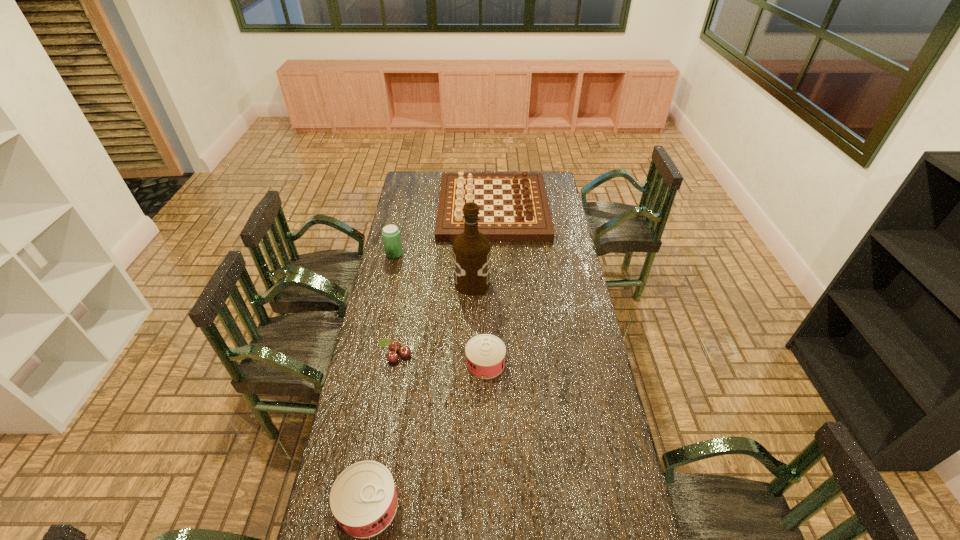
Locate an element on the screen. free space located on the back of the shortest object is located at coordinates (485, 292).

Identify the location of vacant space positioned on the side with the white pieces of the gameboard. Image resolution: width=960 pixels, height=540 pixels. (407, 208).

You are a GUI agent. You are given a task and a screenshot of the screen. Output one action in this format:
    pyautogui.click(x=<x>, y=<y>)
    Task: Click on the vacant space situated 0.180m on the side with the white pieces of the gameboard
    
    Given the screenshot: What is the action you would take?
    pyautogui.click(x=407, y=208)

Locate an element on the screen. vacant area situated 0.120m on the side with the white pieces of the gameboard is located at coordinates (418, 208).

Where is `vacant space situated 0.180m on the back of the soda`? The width and height of the screenshot is (960, 540). vacant space situated 0.180m on the back of the soda is located at coordinates (400, 227).

In order to click on vacant space located 0.230m on the label of the alcohol in this screenshot , I will do `click(540, 284)`.

This screenshot has width=960, height=540. I want to click on free space located 0.200m on the leaves of the cherry, so click(386, 414).

The height and width of the screenshot is (540, 960). What are the coordinates of `object present at the far edge` in the screenshot? It's located at (525, 215).

You are a GUI agent. You are given a task and a screenshot of the screen. Output one action in this format:
    pyautogui.click(x=<x>, y=<y>)
    Task: Click on the object that is at the near edge
    
    Given the screenshot: What is the action you would take?
    pyautogui.click(x=363, y=499)

Locate an element on the screen. This screenshot has width=960, height=540. can at the left edge is located at coordinates (363, 499).